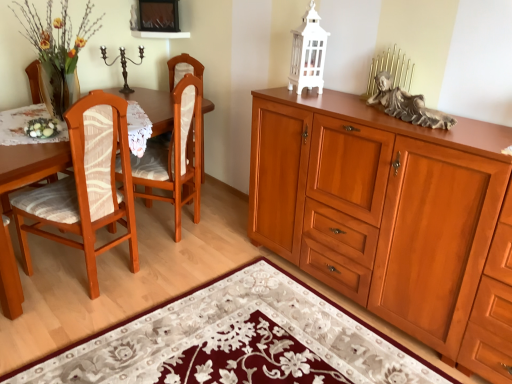
Locate an element on the screen. The width and height of the screenshot is (512, 384). vacant area situated below wooden chair at left, placed as the first chair when sorted from front to back (from a real-world perspective) is located at coordinates (81, 272).